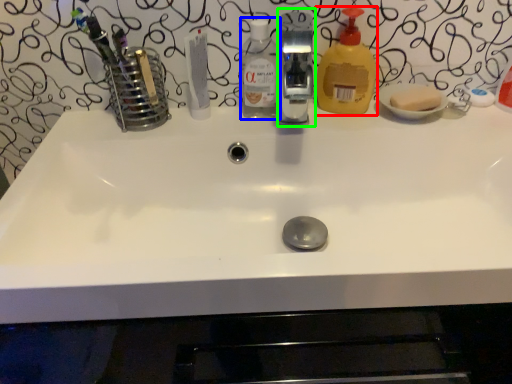
Question: Which object is the closest to the cleaning product (highlighted by a red box)? Choose among these: bottle (highlighted by a blue box) or fixture (highlighted by a green box).

Choices:
 (A) bottle
 (B) fixture

Answer: (A)